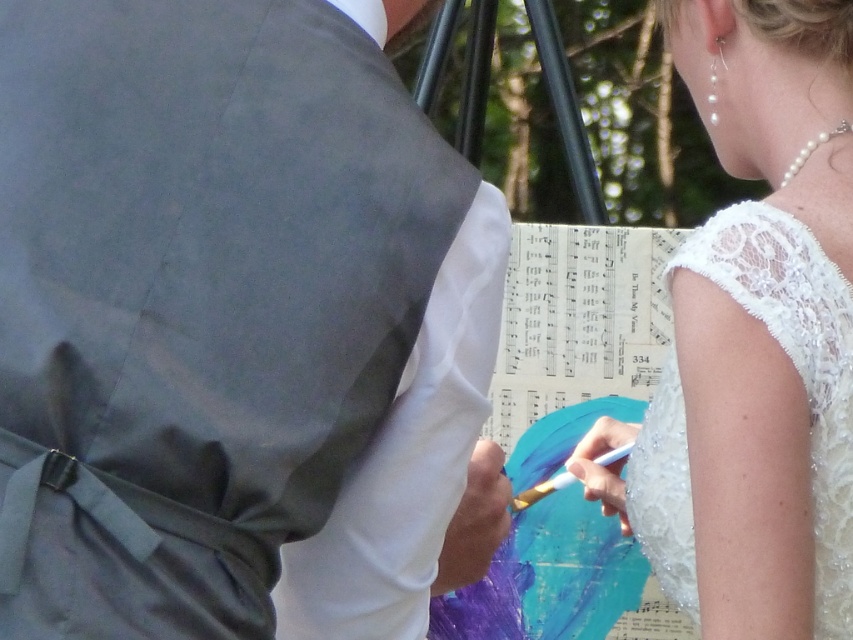
Who is more distant from viewer, (181, 609) or (837, 362)?

Positioned behind is point (837, 362).

Is matte gray vest at center behind white lace dress at upper right?

No.

In order to click on matte gray vest at center in this screenshot , I will do `click(230, 321)`.